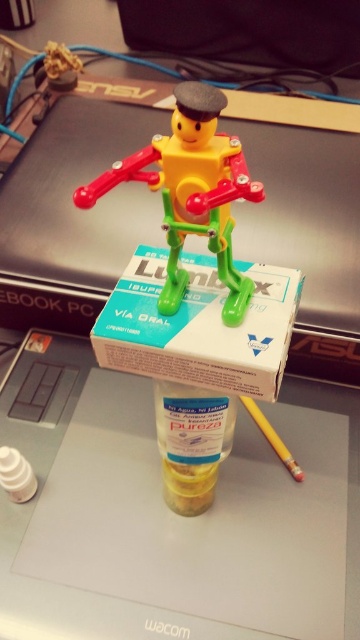
You are a delivery drone with a 24 inch wide package. You need to fly through the space between the two points marked at point (101,326). Will your package fit through the space?

The distance between the two points marked at point (101,326) is 26.28 inches. Since your package is 24 inches wide, it will fit through the space as there is enough clearance.

You are a photographer holding a camera and want to take a closeup shot of the translucent plastic bottle at center. The recommended distance for a clear closeup is 24 inches. Is the camera currently positioned too far away or too close?

The camera and the translucent plastic bottle at center are 27.85 inches apart. Since the recommended distance is 24 inches, the camera is positioned too far away.

You are organizing your desk and want to place a new item on the green cardboard box at center. What are the coordinates where you should place it?

The coordinates for the green cardboard box at center are at point (199, 326).